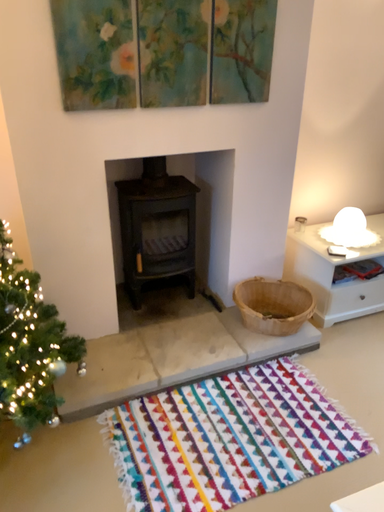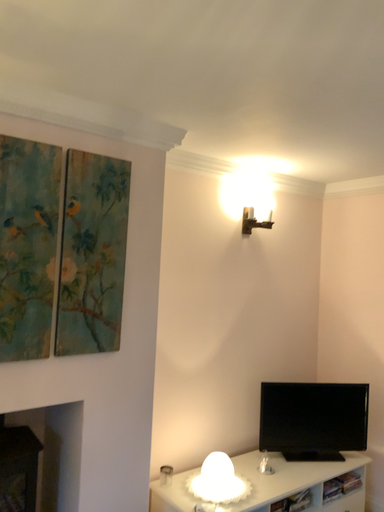
Question: How did the camera likely rotate when shooting the video?

Choices:
 (A) rotated downward
 (B) rotated upward

Answer: (B)